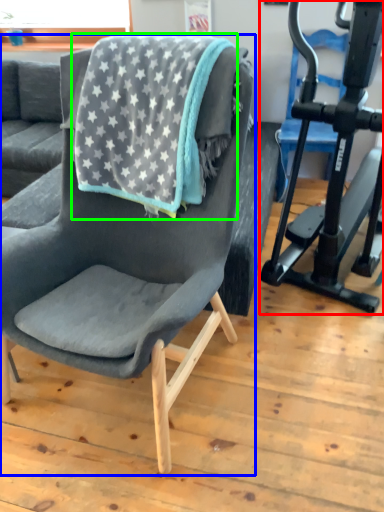
Question: Which object is the farthest from stationary bicycle (highlighted by a red box)? Choose among these: chair (highlighted by a blue box) or beach towel (highlighted by a green box).

Choices:
 (A) chair
 (B) beach towel

Answer: (A)